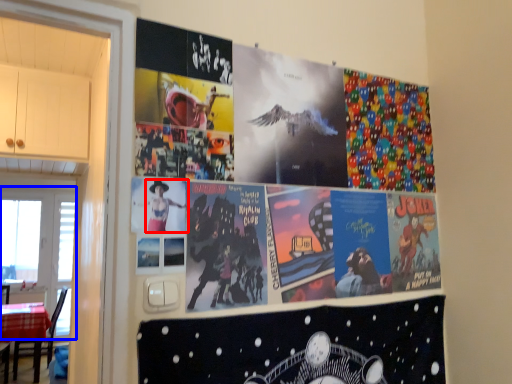
Question: Among these objects, which one is farthest to the camera, person (highlighted by a red box) or window screen (highlighted by a blue box)?

Choices:
 (A) person
 (B) window screen

Answer: (B)